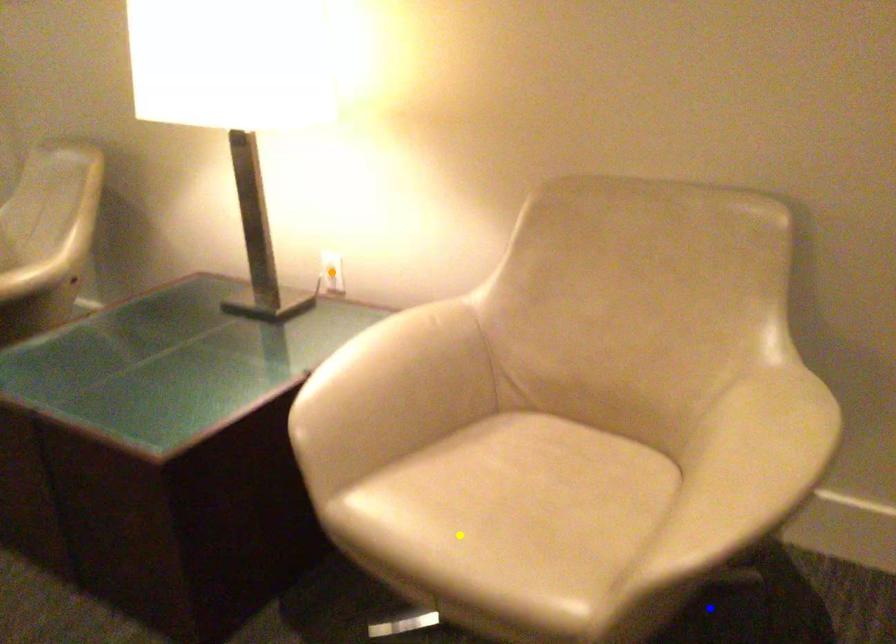
Order these from nearest to farthest:
A) orange point
B) blue point
C) yellow point

yellow point → blue point → orange point